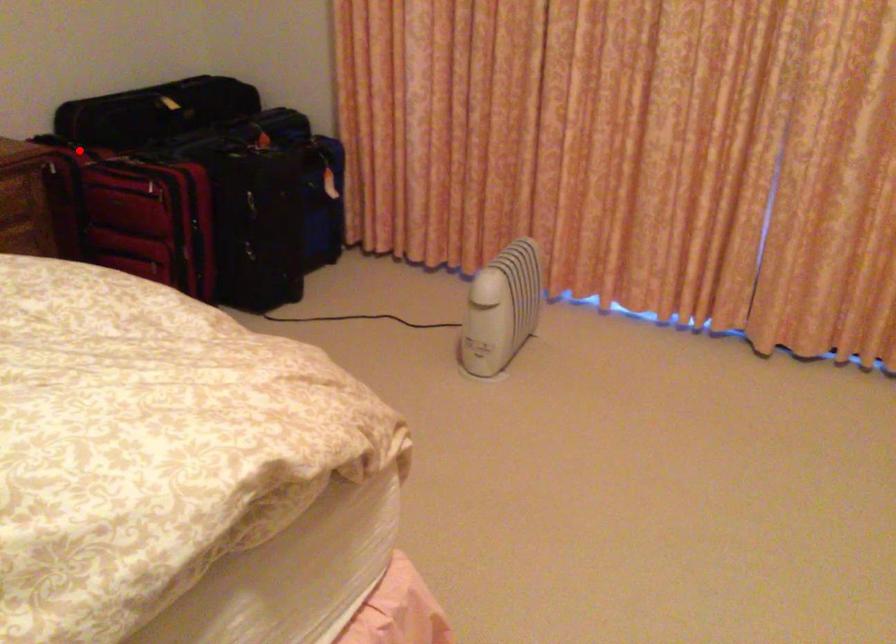
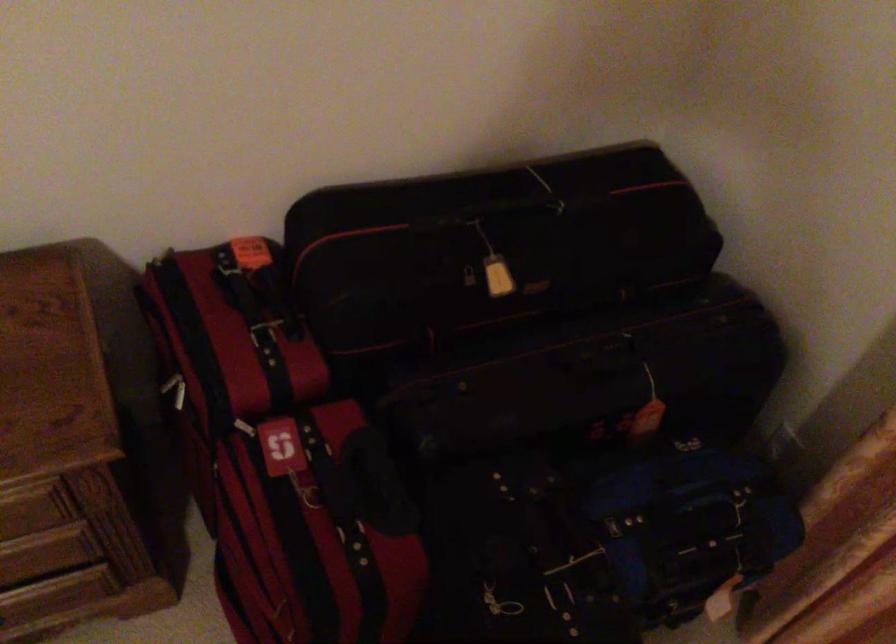
Locate, in the second image, the point that corresponds to the highlighted location in the first image.

(264, 334)